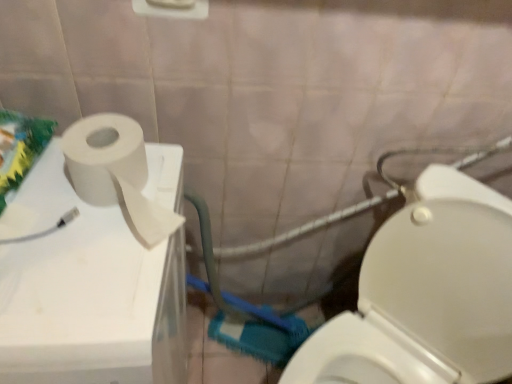
Question: From the image's perspective, is white glossy toilet at lower right located beneath white matte toilet paper at upper left?

Choices:
 (A) no
 (B) yes

Answer: (B)

Question: Does white glossy toilet at lower right have a greater width compared to white matte toilet paper at upper left?

Choices:
 (A) no
 (B) yes

Answer: (B)

Question: Does white glossy toilet at lower right have a lesser width compared to white matte toilet paper at upper left?

Choices:
 (A) no
 (B) yes

Answer: (A)

Question: Is white glossy toilet at lower right smaller than white matte toilet paper at upper left?

Choices:
 (A) no
 (B) yes

Answer: (B)

Question: Is white glossy toilet at lower right bigger than white matte toilet paper at upper left?

Choices:
 (A) no
 (B) yes

Answer: (A)

Question: Can you confirm if white glossy toilet at lower right is positioned to the right of white matte toilet paper at upper left?

Choices:
 (A) no
 (B) yes

Answer: (B)

Question: Is the position of white matte toilet paper at upper left less distant than that of white glossy toilet at lower right?

Choices:
 (A) no
 (B) yes

Answer: (A)

Question: Is white matte toilet paper at upper left facing away from white glossy toilet at lower right?

Choices:
 (A) yes
 (B) no

Answer: (B)

Question: From a real-world perspective, does white matte toilet paper at upper left sit lower than white glossy toilet at lower right?

Choices:
 (A) no
 (B) yes

Answer: (A)

Question: Is white matte toilet paper at upper left shorter than white glossy toilet at lower right?

Choices:
 (A) no
 (B) yes

Answer: (B)

Question: Does white matte toilet paper at upper left have a larger size compared to white glossy toilet at lower right?

Choices:
 (A) yes
 (B) no

Answer: (A)

Question: From a real-world perspective, is white matte toilet paper at upper left physically above white glossy toilet at lower right?

Choices:
 (A) no
 (B) yes

Answer: (B)

Question: From a real-world perspective, is white matte toilet paper at left on top of white glossy toilet at lower right?

Choices:
 (A) yes
 (B) no

Answer: (A)